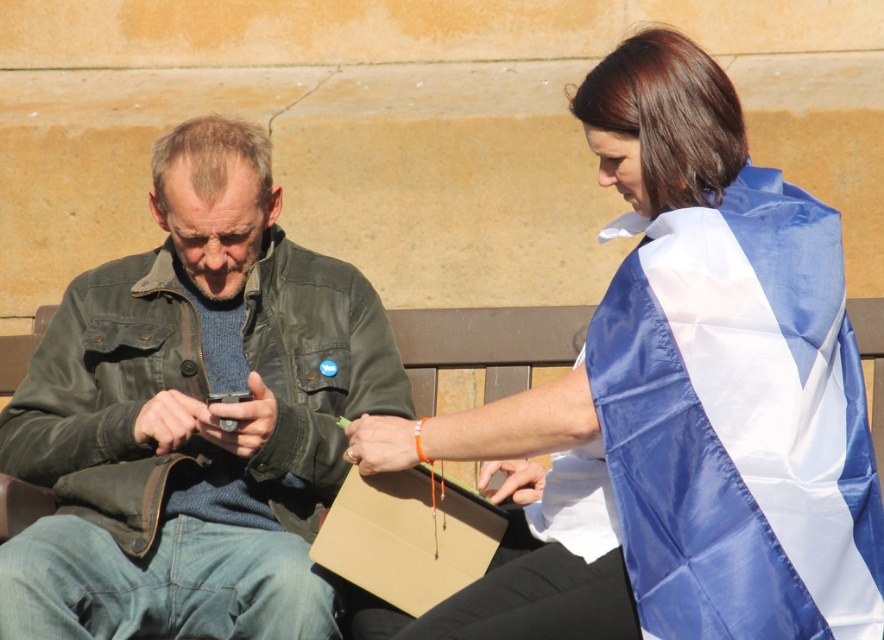
You are a photographer positioned at the center of the scene. You want to capture a photo where the blue satin flag at upper right is centered in the frame. Which direction should you move to align the flag properly?

The blue satin flag at upper right is located at point (684, 394), which means it is positioned to the right and slightly above the center. To center it, you should move to the left and slightly downward.

You are a photographer trying to capture both the blue satin flag at upper right and the leather jacket at left in a single frame. Based on their sizes, which object should you focus on first to ensure both are in the frame?

The blue satin flag at upper right is taller than the leather jacket at left, so you should focus on the blue satin flag at upper right first to ensure both are in the frame.

You are a photographer taking a picture of the scene. The blue satin flag at upper right and the leather jacket at left are both in the frame. Which object is covering part of the other?

The blue satin flag at upper right is positioned over the leather jacket at left, so it is covering part of it.